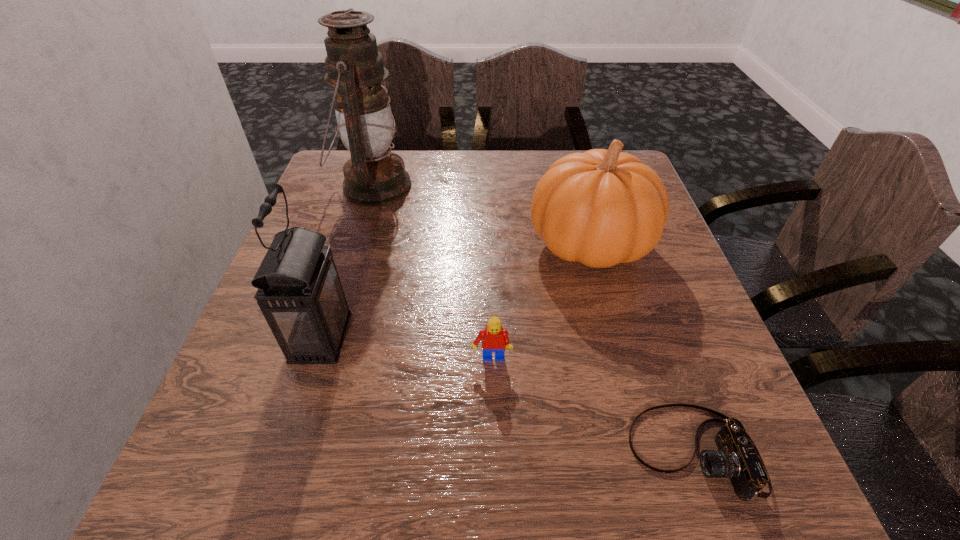
Where is `object that is at the far left corner`? This screenshot has height=540, width=960. object that is at the far left corner is located at coordinates (374, 176).

Where is `object that is at the near right corner`? object that is at the near right corner is located at coordinates (737, 458).

The image size is (960, 540). Identify the location of free region at the far edge of the desktop. (468, 168).

This screenshot has height=540, width=960. Identify the location of vacant region at the near edge of the desktop. (396, 448).

Image resolution: width=960 pixels, height=540 pixels. I want to click on blank area at the left edge, so click(357, 264).

This screenshot has width=960, height=540. In the image, there is a desktop. In order to click on vacant space at the right edge in this screenshot , I will do `click(647, 312)`.

In the image, there is a desktop. At what (x,y) coordinates should I click in order to perform the action: click on vacant space at the far left corner. Please return your answer as a coordinate pair (x, y). The height and width of the screenshot is (540, 960). Looking at the image, I should click on (313, 197).

The image size is (960, 540). In order to click on vacant space in between the third shortest object and the shortest object in this screenshot , I will do `click(641, 348)`.

Find the location of a particular element. This screenshot has height=540, width=960. vacant space that's between the second tallest object and the nearest object is located at coordinates (507, 395).

This screenshot has height=540, width=960. I want to click on free space between the pumpkin and the lantern, so click(455, 291).